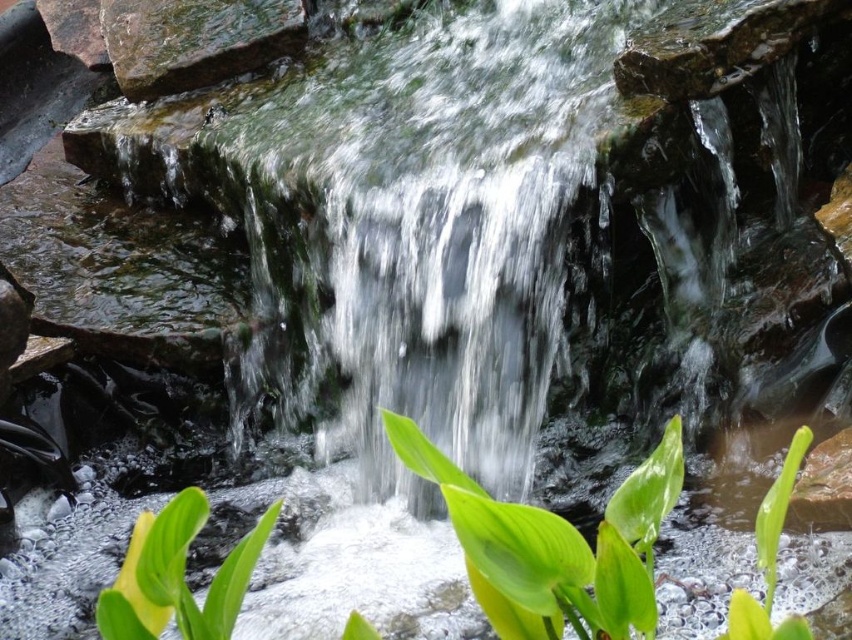
Question: Among these objects, which one is farthest from the camera?

Choices:
 (A) green leafy plant at lower center
 (B) green glossy leaf at center
 (C) green leafy plant at lower right

Answer: (A)

Question: Which object is closer to the camera taking this photo?

Choices:
 (A) green glossy leaf at center
 (B) green leafy plant at lower center
 (C) green leafy plant at lower right

Answer: (A)

Question: Which object is positioned farthest from the green glossy leaf at center?

Choices:
 (A) green leafy plant at lower center
 (B) green leafy plant at lower right

Answer: (A)

Question: Is green glossy leaf at center thinner than green leafy plant at lower right?

Choices:
 (A) no
 (B) yes

Answer: (B)

Question: Is green glossy leaf at center below green leafy plant at lower center?

Choices:
 (A) no
 (B) yes

Answer: (A)

Question: Considering the relative positions of green glossy leaf at center and green leafy plant at lower center in the image provided, where is green glossy leaf at center located with respect to green leafy plant at lower center?

Choices:
 (A) left
 (B) right

Answer: (B)